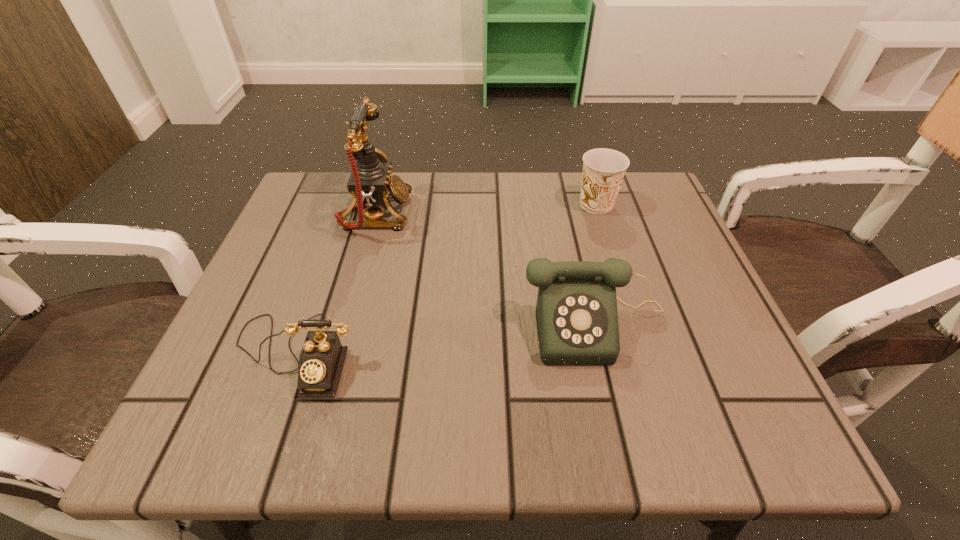
Find the location of `free area in between the shortest telephone and the tallest object`. free area in between the shortest telephone and the tallest object is located at coordinates (336, 284).

You are a GUI agent. You are given a task and a screenshot of the screen. Output one action in this format:
    pyautogui.click(x=<x>, y=<y>)
    Task: Click on the object that stands as the third closest to the Dixie cup
    The width and height of the screenshot is (960, 540).
    Given the screenshot: What is the action you would take?
    pyautogui.click(x=322, y=357)

The width and height of the screenshot is (960, 540). In order to click on object that is the second closest to the Dixie cup in this screenshot , I will do `click(370, 183)`.

The height and width of the screenshot is (540, 960). Identify the location of telephone that is the second closest to the shortest object. (576, 312).

This screenshot has height=540, width=960. In order to click on telephone that is the second closest one to the rightmost telephone in this screenshot , I will do `click(322, 357)`.

The image size is (960, 540). I want to click on free location that satisfies the following two spatial constraints: 1. on the front of the tallest object, featuring the rotary dial; 2. on the dial of the shortest object, so click(x=337, y=354).